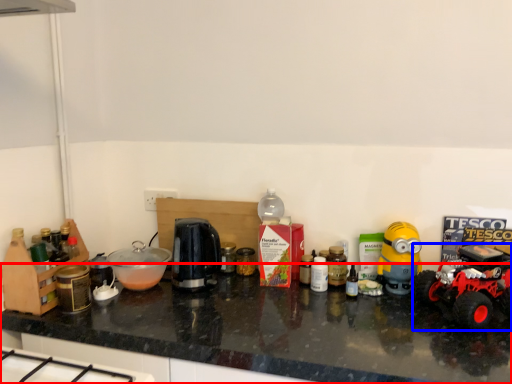
Question: Which object is closer to the camera taking this photo, countertop (highlighted by a red box) or land vehicle (highlighted by a blue box)?

Choices:
 (A) countertop
 (B) land vehicle

Answer: (A)